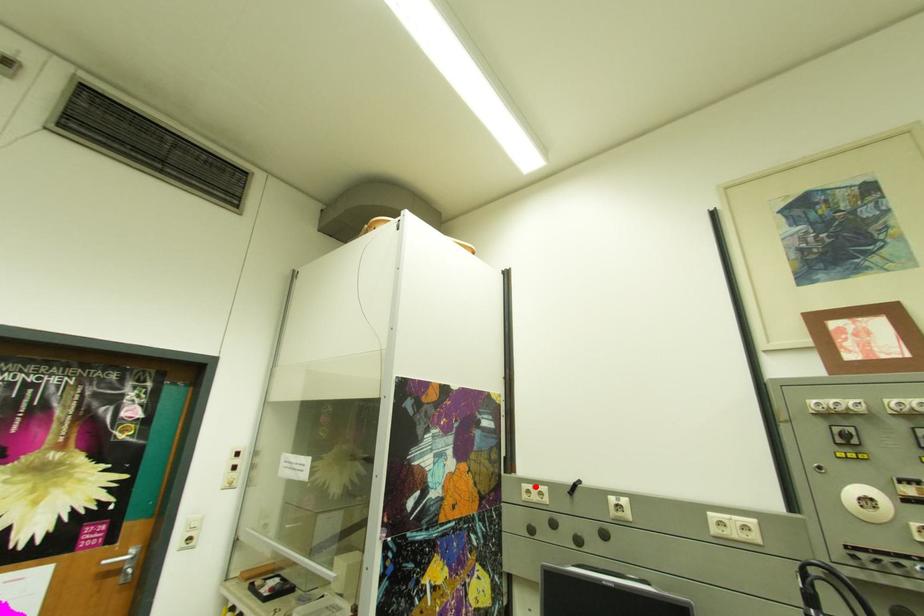
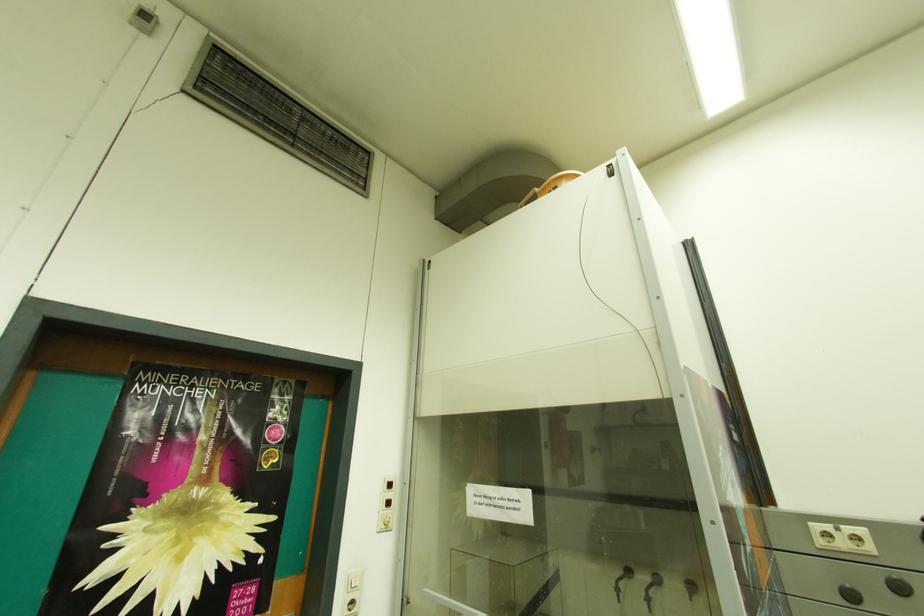
Question: I am providing you with two images of the same scene from different viewpoints. Given a red point in image1, look at the same physical point in image2. Is it:

Choices:
 (A) Closer to the viewpoint
 (B) Farther from the viewpoint

Answer: (A)